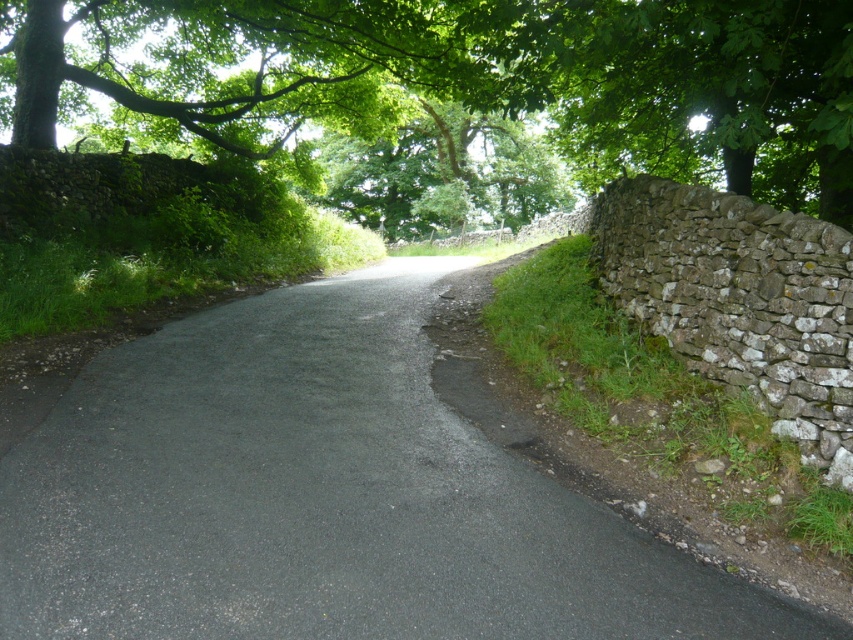
You are a hiker who wants to walk along the asphalt road at center. There is a green leafy tree at upper left overhead. Will the tree provide shade on the road?

The asphalt road at center is positioned under the green leafy tree at upper left, so the tree does provide shade on the road.

You are standing at the starting point of the asphalt road at center. If you walk straight along the road, where will you end up?

The asphalt road at center leads into the distance where it merges with another path or possibly a field, so walking straight along it would take you towards that merging point.